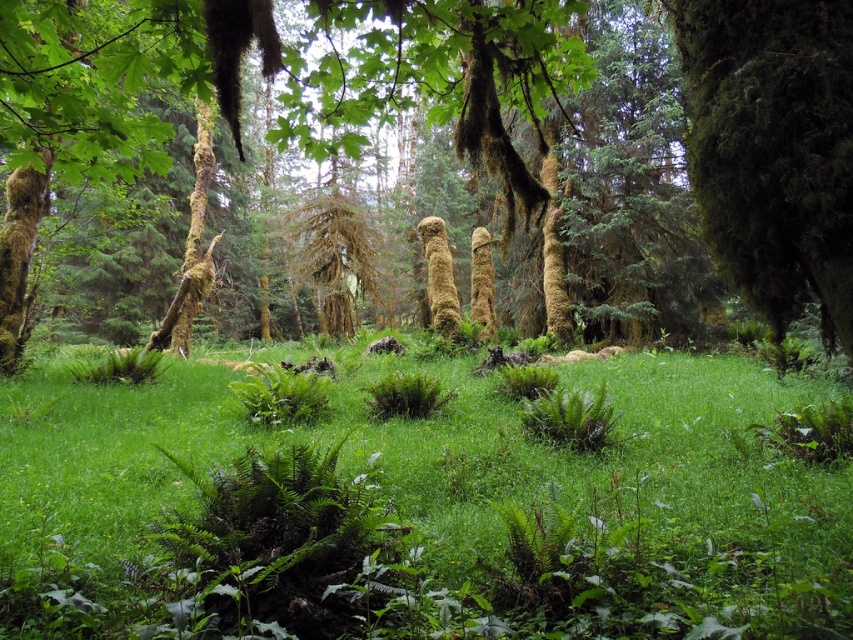
Question: Which point is closer to the camera taking this photo?

Choices:
 (A) (44, 182)
 (B) (270, 602)
 (C) (692, 84)
 (D) (676, 13)

Answer: (C)

Question: Where is green mossy tree at center located in relation to green mossy tree trunk at left in the image?

Choices:
 (A) below
 (B) above

Answer: (B)

Question: Can you confirm if green mossy tree at right is positioned to the right of green mossy tree trunk at left?

Choices:
 (A) yes
 (B) no

Answer: (A)

Question: Does green grassy at center lie in front of green mossy tree at center?

Choices:
 (A) no
 (B) yes

Answer: (A)

Question: Among these objects, which one is farthest from the camera?

Choices:
 (A) green mossy tree at center
 (B) green mossy tree at right

Answer: (B)

Question: Which object is closer to the camera taking this photo?

Choices:
 (A) green mossy tree trunk at left
 (B) green grassy at center
 (C) green mossy tree at center

Answer: (C)